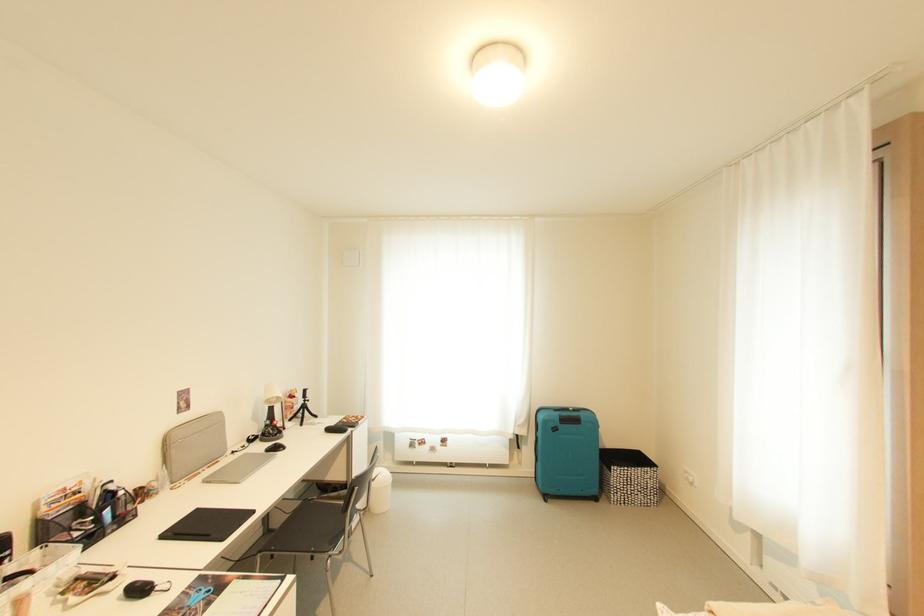
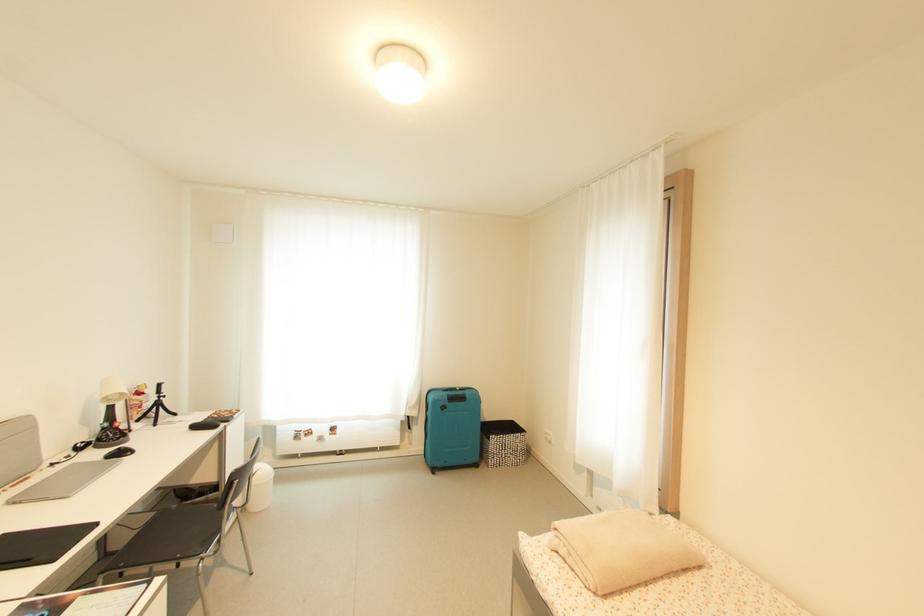
Question: Based on the continuous images, in which direction is the camera rotating? Reply with the corresponding letter.

Choices:
 (A) Left
 (B) Right
 (C) Up
 (D) Down

Answer: (B)